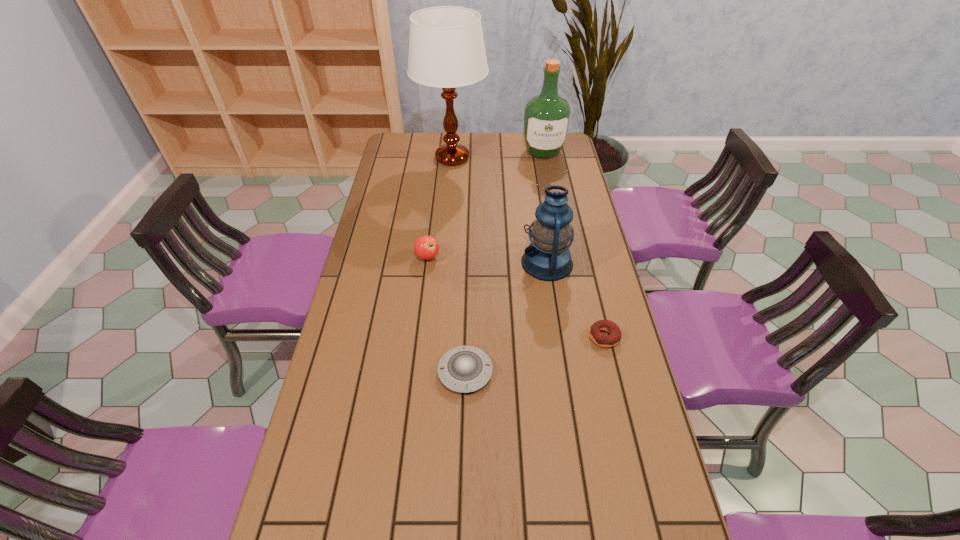
Where is `vacant space in between the doughnut and the lantern`? vacant space in between the doughnut and the lantern is located at coordinates (576, 300).

At what (x,y) coordinates should I click in order to perform the action: click on vacant area that lies between the table lamp and the saucer. Please return your answer as a coordinate pair (x, y). This screenshot has height=540, width=960. Looking at the image, I should click on (459, 265).

Locate an element on the screen. This screenshot has height=540, width=960. unoccupied area between the tallest object and the fifth shortest object is located at coordinates click(497, 155).

You are a GUI agent. You are given a task and a screenshot of the screen. Output one action in this format:
    pyautogui.click(x=<x>, y=<y>)
    Task: Click on the unoccupied position between the tallest object and the second tallest object
    This screenshot has height=540, width=960.
    Given the screenshot: What is the action you would take?
    pyautogui.click(x=497, y=155)

Where is `free spot between the tallest object and the saucer`? The height and width of the screenshot is (540, 960). free spot between the tallest object and the saucer is located at coordinates (459, 265).

Identify which object is located as the fifth nearest to the doughnut. Please provide its 2D coordinates. Your answer should be formatted as a tuple, i.e. [(x, y)], where the tuple contains the x and y coordinates of a point satisfying the conditions above.

[(546, 116)]

Identify which object is the fourth closest to the doughnut. Please provide its 2D coordinates. Your answer should be formatted as a tuple, i.e. [(x, y)], where the tuple contains the x and y coordinates of a point satisfying the conditions above.

[(446, 46)]

Locate an element on the screen. The width and height of the screenshot is (960, 540). vacant space that satisfies the following two spatial constraints: 1. on the front-facing side of the doughnut; 2. on the right side of the liquor is located at coordinates (578, 337).

Image resolution: width=960 pixels, height=540 pixels. Find the location of `free space that satisfies the following two spatial constraints: 1. on the front-facing side of the liquor; 2. on the left side of the doughnut`. free space that satisfies the following two spatial constraints: 1. on the front-facing side of the liquor; 2. on the left side of the doughnut is located at coordinates (578, 337).

Where is `vacant space that satisfies the following two spatial constraints: 1. on the front-facing side of the doughnut; 2. on the right side of the fifth shortest object`? The height and width of the screenshot is (540, 960). vacant space that satisfies the following two spatial constraints: 1. on the front-facing side of the doughnut; 2. on the right side of the fifth shortest object is located at coordinates (578, 337).